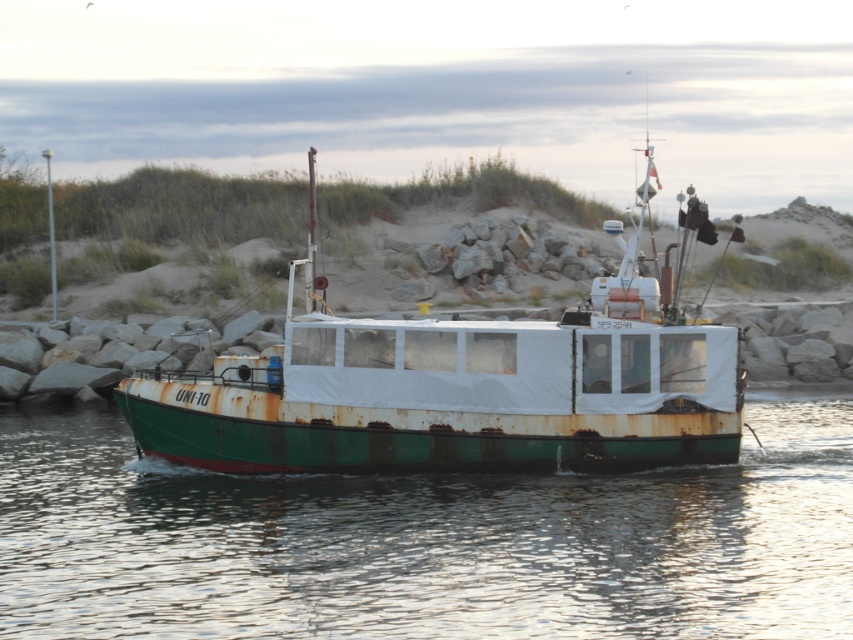
You are standing on the deck of the boat UNI 10 and want to move from the point at coordinates point (560, 509) to the point at coordinates point (563, 358). Which direction should you move relative to the boat?

You should move towards the back of the boat because point (560, 509) is in front of point (563, 358).

You are standing on the dock and see the green rusty water at center and the rusty metal boat at center. Which object is positioned to the left?

The green rusty water at center is to the left of the rusty metal boat at center.

You are a marine biologist examining the image of the boat and water. Which object has a smaller width between the green rusty water at center and the rusty metal boat at center?

The green rusty water at center is thinner than the rusty metal boat at center, so the green rusty water at center has a smaller width.